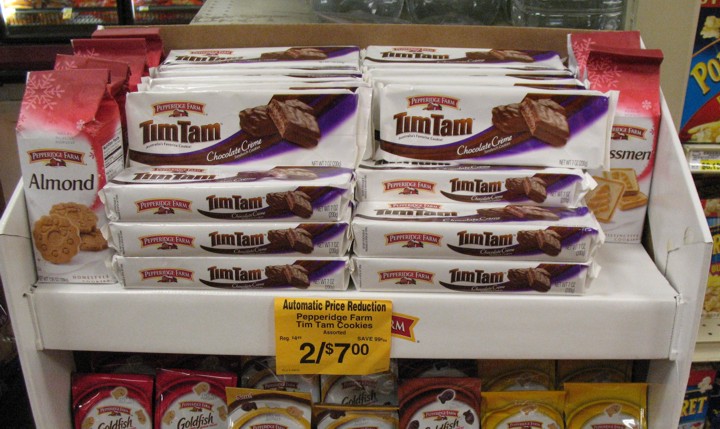
Locate an element on the screen. The image size is (720, 429). boxes is located at coordinates (274, 151).